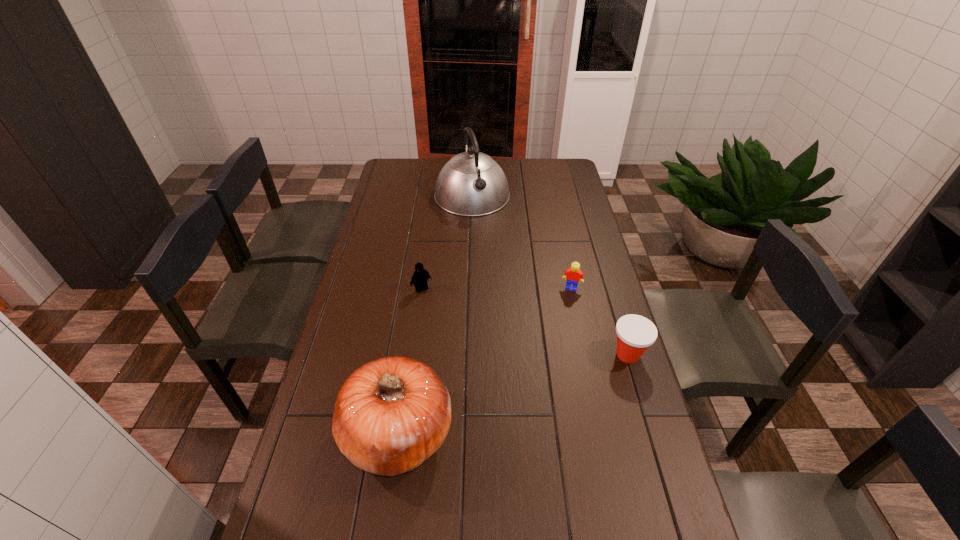
At what (x,y) coordinates should I click in order to perform the action: click on unoccupied area between the rightmost object and the farthest object. Please return your answer as a coordinate pair (x, y). Looking at the image, I should click on (550, 275).

Identify the location of vacant area that lies between the left Lego and the Dixie cup. (525, 322).

This screenshot has height=540, width=960. What are the coordinates of `empty location between the right Lego and the second nearest object` in the screenshot? It's located at (600, 321).

At what (x,y) coordinates should I click in order to perform the action: click on free space between the fourth farthest object and the pumpkin. Please return your answer as a coordinate pair (x, y). This screenshot has width=960, height=540. Looking at the image, I should click on (514, 393).

Where is `blank region between the nearest object and the Dixie cup`? The height and width of the screenshot is (540, 960). blank region between the nearest object and the Dixie cup is located at coordinates (514, 393).

Find the location of a particular element. The width and height of the screenshot is (960, 540). free area in between the rightmost object and the left Lego is located at coordinates (525, 322).

You are a GUI agent. You are given a task and a screenshot of the screen. Output one action in this format:
    pyautogui.click(x=<x>, y=<y>)
    Task: Click on the vacant space that is in between the fourth farthest object and the right Lego
    The height and width of the screenshot is (540, 960).
    Given the screenshot: What is the action you would take?
    pyautogui.click(x=600, y=321)

At what (x,y) coordinates should I click in order to perform the action: click on object that is the closest to the fourth farthest object. Please return your answer as a coordinate pair (x, y). Looking at the image, I should click on (573, 274).

Locate which object ranks second in proximity to the tallest object. Please provide its 2D coordinates. Your answer should be formatted as a tuple, i.e. [(x, y)], where the tuple contains the x and y coordinates of a point satisfying the conditions above.

[(573, 274)]

Identify the location of free space that satisfies the following two spatial constraints: 1. on the back side of the left Lego; 2. on the right side of the second object from right to left. (421, 288).